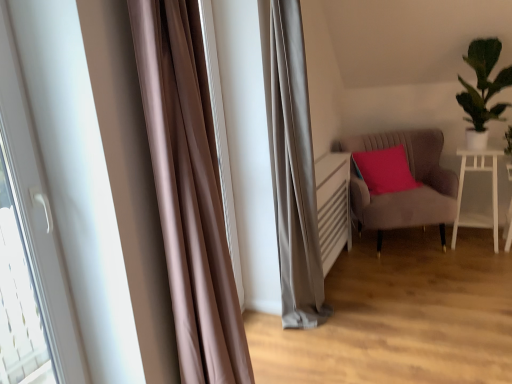
At what (x,y) coordinates should I click in order to perform the action: click on vacant space in between suede-like beige armchair at right and satin brown curtain at left. Please return your answer as a coordinate pair (x, y). The width and height of the screenshot is (512, 384). Looking at the image, I should click on (359, 296).